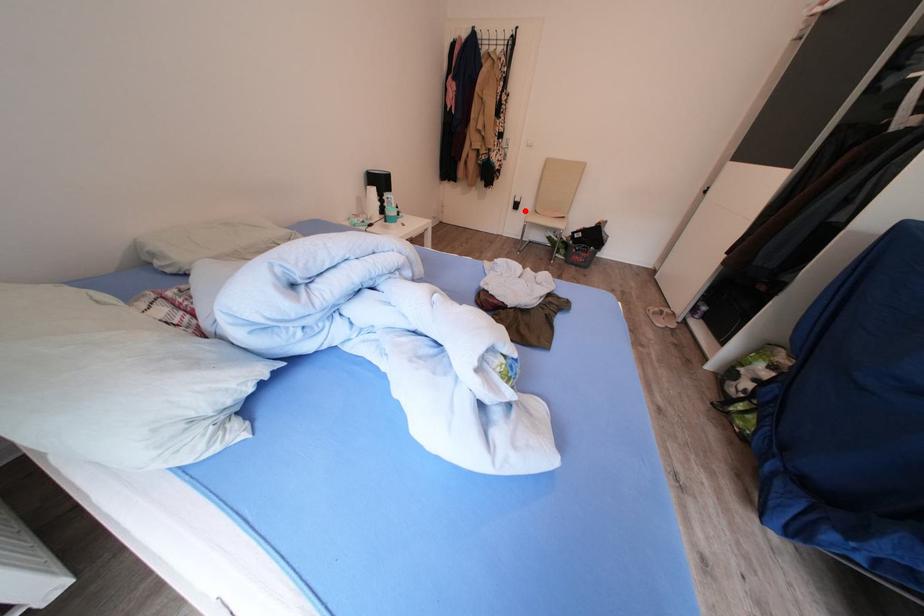
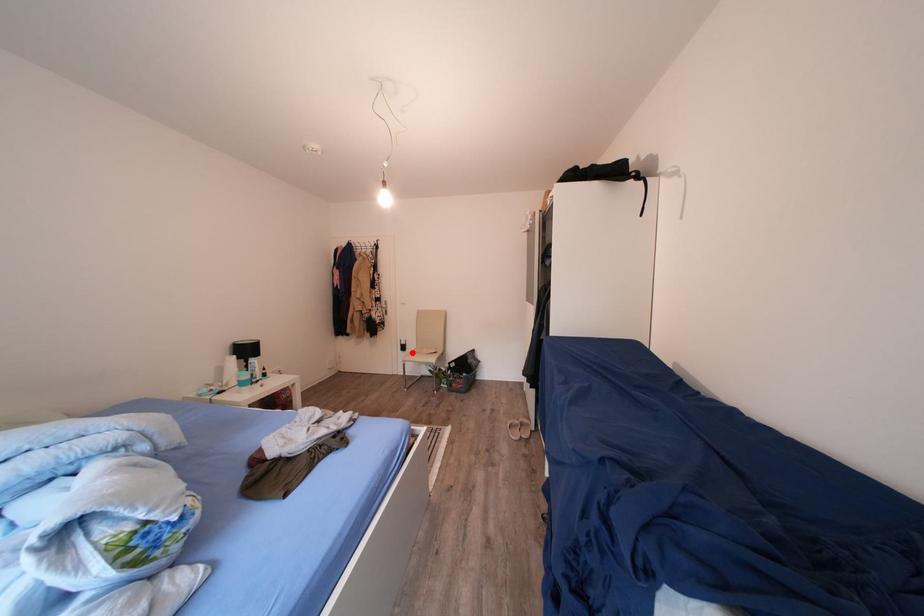
I am providing you with two images of the same scene from different viewpoints. A red point is marked on the first image and another point is marked on the second image. Is the marked point in image1 the same physical position as the marked point in image2?

Yes